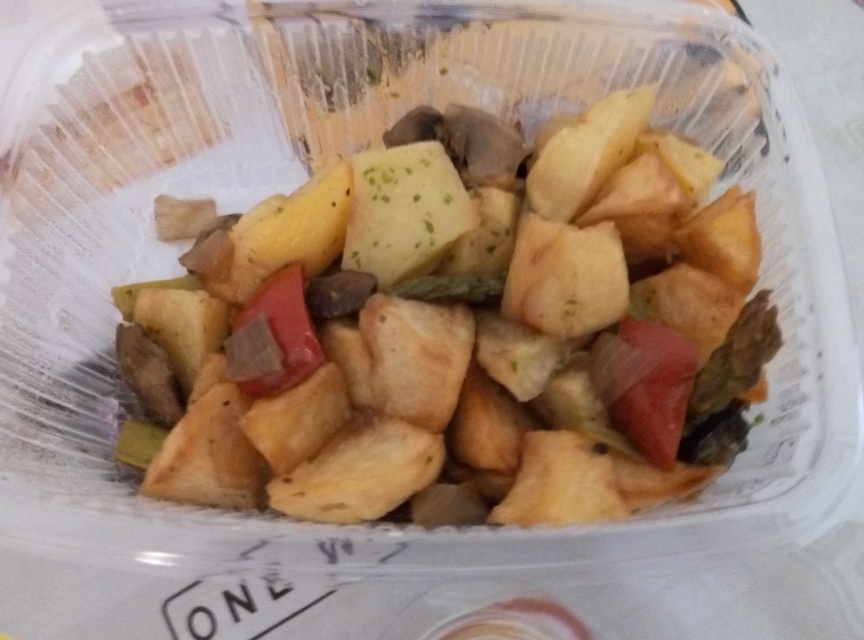
Question: Which point appears farthest from the camera in this image?

Choices:
 (A) (271, 291)
 (B) (666, 444)

Answer: (A)

Question: Does golden brown fried potatoes at center appear over red matte tomato at center?

Choices:
 (A) no
 (B) yes

Answer: (B)

Question: Which of the following is the closest to the observer?

Choices:
 (A) matte brown pepper at center
 (B) golden brown fried potatoes at center
 (C) red matte tomato at center

Answer: (B)

Question: Which of the following is the farthest from the observer?

Choices:
 (A) (650, 304)
 (B) (286, 323)

Answer: (A)

Question: Can you confirm if golden brown fried potatoes at center is smaller than matte brown pepper at center?

Choices:
 (A) yes
 (B) no

Answer: (B)

Question: In this image, where is golden brown fried potatoes at center located relative to matte brown pepper at center?

Choices:
 (A) below
 (B) above

Answer: (B)